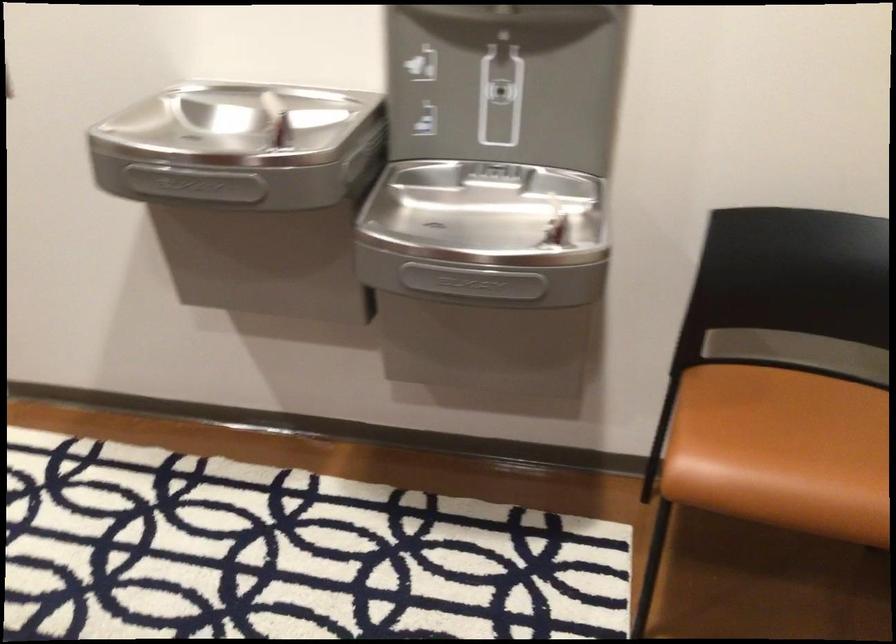
Locate an element on the screen. chair sitting surface is located at coordinates (786, 431).